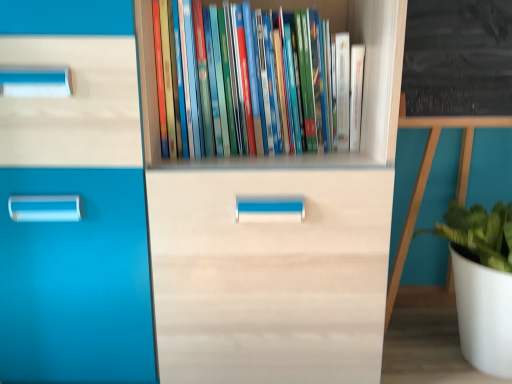
What do you see at coordinates (248, 81) in the screenshot? The image size is (512, 384). I see `hardcover books at center` at bounding box center [248, 81].

I want to click on hardcover books at center, so coord(248,81).

Where is `white matte pot at right`? The width and height of the screenshot is (512, 384). white matte pot at right is located at coordinates (481, 282).

The image size is (512, 384). Describe the element at coordinates (481, 282) in the screenshot. I see `white matte pot at right` at that location.

You are a GUI agent. You are given a task and a screenshot of the screen. Output one action in this format:
    pyautogui.click(x=<x>, y=<y>)
    Task: Click on the hardcover books at center
    
    Given the screenshot: What is the action you would take?
    click(248, 81)

Between white matte pot at right and hardcover books at center, which one appears on the left side from the viewer's perspective?

Result: From the viewer's perspective, hardcover books at center appears more on the left side.

Which object is closer to the camera taking this photo, white matte pot at right or hardcover books at center?

hardcover books at center is in front.

Which point is more distant from viewer, [470,211] or [252,111]?

The point [470,211] is farther.

Consider the image. From the image's perspective, between white matte pot at right and hardcover books at center, which one is located above?

hardcover books at center appears higher in the image.

From a real-world perspective, is white matte pot at right physically located above or below hardcover books at center?

white matte pot at right is situated lower than hardcover books at center in the real world.

Consider the image. Considering the sizes of objects white matte pot at right and hardcover books at center in the image provided, who is thinner, white matte pot at right or hardcover books at center?

hardcover books at center is thinner.

Who is taller, white matte pot at right or hardcover books at center?

With more height is white matte pot at right.

Considering the sizes of white matte pot at right and hardcover books at center in the image, is white matte pot at right bigger or smaller than hardcover books at center?

white matte pot at right is bigger than hardcover books at center.

Would you say white matte pot at right contains hardcover books at center?

No, hardcover books at center is not surrounded by white matte pot at right.

Looking at this image, is white matte pot at right next to hardcover books at center?

No, white matte pot at right is not touching hardcover books at center.

Is hardcover books at center at the back of white matte pot at right?

white matte pot at right is not turned away from hardcover books at center.

Can you tell me how much white matte pot at right and hardcover books at center differ in facing direction?

white matte pot at right and hardcover books at center are facing 0.00011 degrees away from each other.

Image resolution: width=512 pixels, height=384 pixels. I want to click on houseplant that appears below the hardcover books at center (from a real-world perspective), so click(481, 282).

Considering the positions of objects hardcover books at center and white matte pot at right in the image provided, who is more to the right, hardcover books at center or white matte pot at right?

From the viewer's perspective, white matte pot at right appears more on the right side.

Is hardcover books at center positioned behind white matte pot at right?

No, the depth of hardcover books at center is less than that of white matte pot at right.

Which is behind, point (218, 79) or point (501, 368)?

Point (501, 368)

From the image's perspective, which object appears higher, hardcover books at center or white matte pot at right?

From the image's view, hardcover books at center is above.

From a real-world perspective, does hardcover books at center stand above white matte pot at right?

Yes.

Considering the sizes of hardcover books at center and white matte pot at right in the image, is hardcover books at center wider or thinner than white matte pot at right?

Considering their sizes, hardcover books at center looks slimmer than white matte pot at right.

From their relative heights in the image, would you say hardcover books at center is taller or shorter than white matte pot at right?

Clearly, hardcover books at center is shorter compared to white matte pot at right.

Which of these two, hardcover books at center or white matte pot at right, is smaller?

hardcover books at center.

Is hardcover books at center inside or outside of white matte pot at right?

hardcover books at center is spatially situated outside white matte pot at right.

Are hardcover books at center and white matte pot at right beside each other?

No, hardcover books at center is not touching white matte pot at right.

Is hardcover books at center looking in the opposite direction of white matte pot at right?

hardcover books at center is not turned away from white matte pot at right.

How different are the orientations of hardcover books at center and white matte pot at right in degrees?

There is a 0.00011-degree angle between the facing directions of hardcover books at center and white matte pot at right.

Where is `houseplant below the hardcover books at center (from a real-world perspective)`? houseplant below the hardcover books at center (from a real-world perspective) is located at coordinates (481, 282).

Locate an element on the screen. Image resolution: width=512 pixels, height=384 pixels. book positioned vertically above the white matte pot at right (from a real-world perspective) is located at coordinates (248, 81).

In order to click on book located on the left of white matte pot at right in this screenshot , I will do [248, 81].